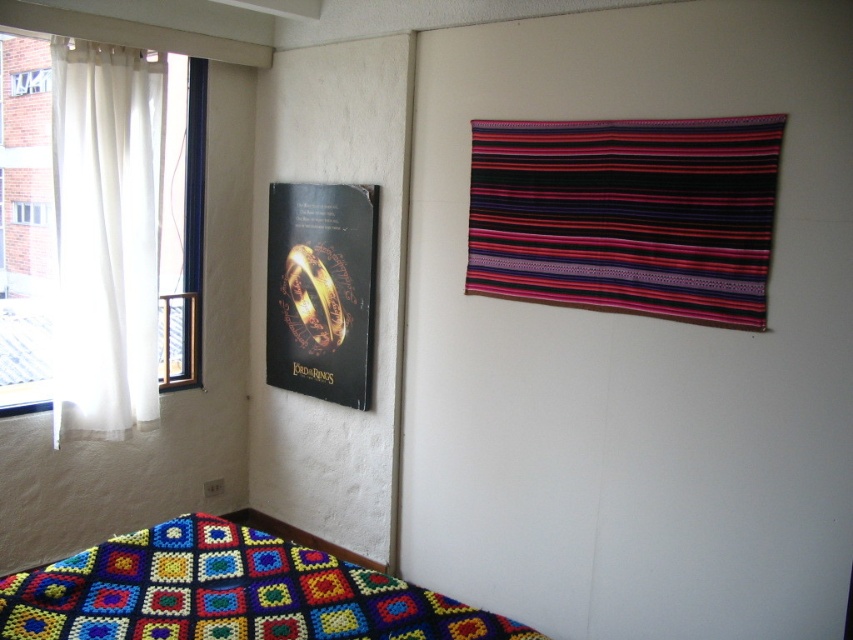
You are a painter standing in the center of the room. You want to paint a mural that covers both the multicolored woven tapestry at upper right and the white sheer curtain at left. What is the minimum width of the mural you need to cover both objects?

The multicolored woven tapestry at upper right and the white sheer curtain at left are 1.76 meters apart from each other. Therefore, the minimum width of the mural should be at least 1.76 meters to cover both objects.

You are an interior designer planning to hang a new painting between the multicolored woven tapestry at upper right and the black paper poster at left. Based on their sizes, which object should the new painting be placed closer to?

The multicolored woven tapestry at upper right is bigger than the black paper poster at left, so the new painting should be placed closer to the black paper poster at left to maintain visual balance.

You are standing in the room and want to reach the point marked at coordinates (660,227). Can you estimate how far you need to walk to reach that point?

The point at coordinates (660,227) is 2.49 meters away from the viewer, so you need to walk approximately 2.49 meters to reach it.